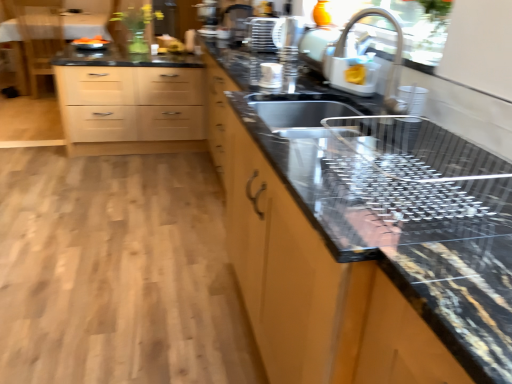
Question: Is point (34, 36) positioned closer to the camera than point (268, 145)?

Choices:
 (A) closer
 (B) farther

Answer: (B)

Question: From the image's perspective, is black granite table at upper left above or below metallic sink at center?

Choices:
 (A) below
 (B) above

Answer: (B)

Question: Which of these objects is positioned closest to the light wood/finish chest of drawers at upper left?

Choices:
 (A) black granite countertop at center
 (B) metallic sink at center
 (C) wooden chair at upper left
 (D) black granite table at upper left
 (E) metallic grid at upper center, positioned as the 2th appliance in right-to-left order

Answer: (E)

Question: Based on their relative distances, which object is farther from the wooden chair at upper left?

Choices:
 (A) black granite table at upper left
 (B) metallic sink at center
 (C) metallic grid at upper center, the second appliance ordered from the bottom
 (D) black granite countertop at center
 (E) light wood/finish chest of drawers at upper left

Answer: (B)